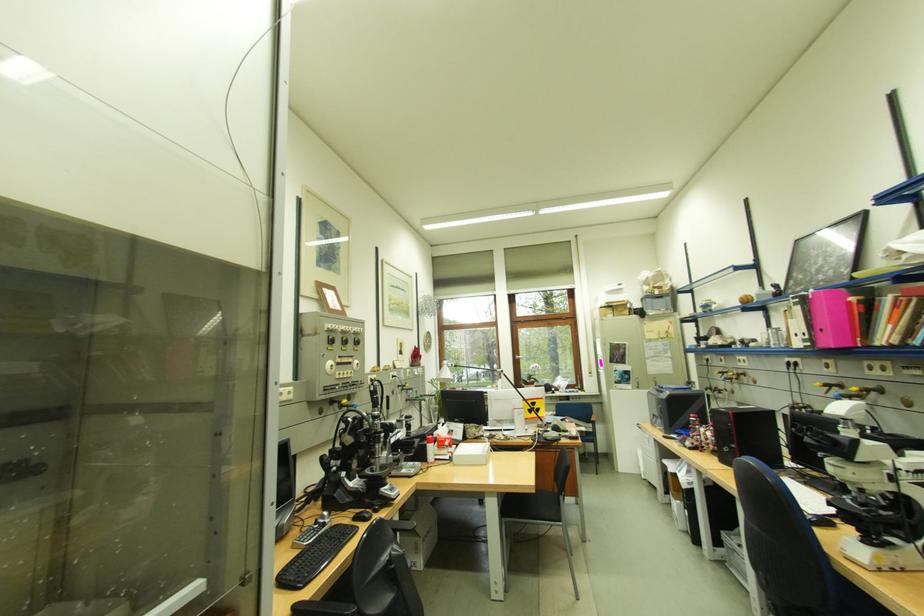
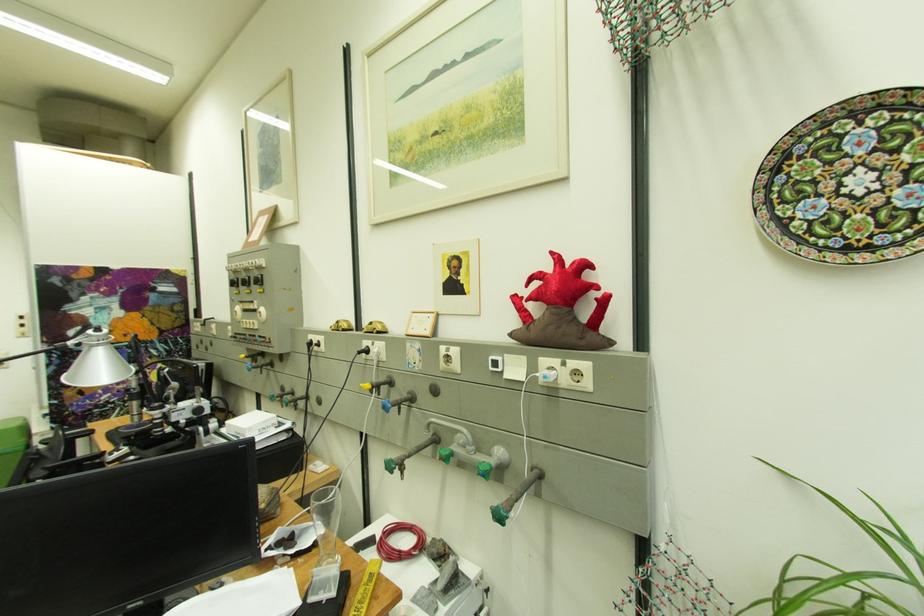
Where in the second image is the point corresponding to (x=379, y=377) from the first image?

(320, 336)